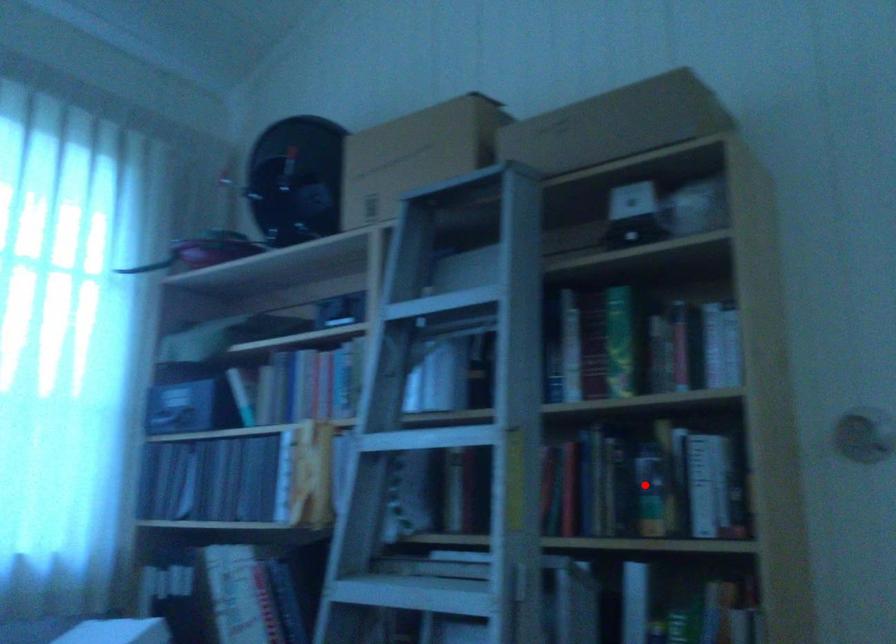
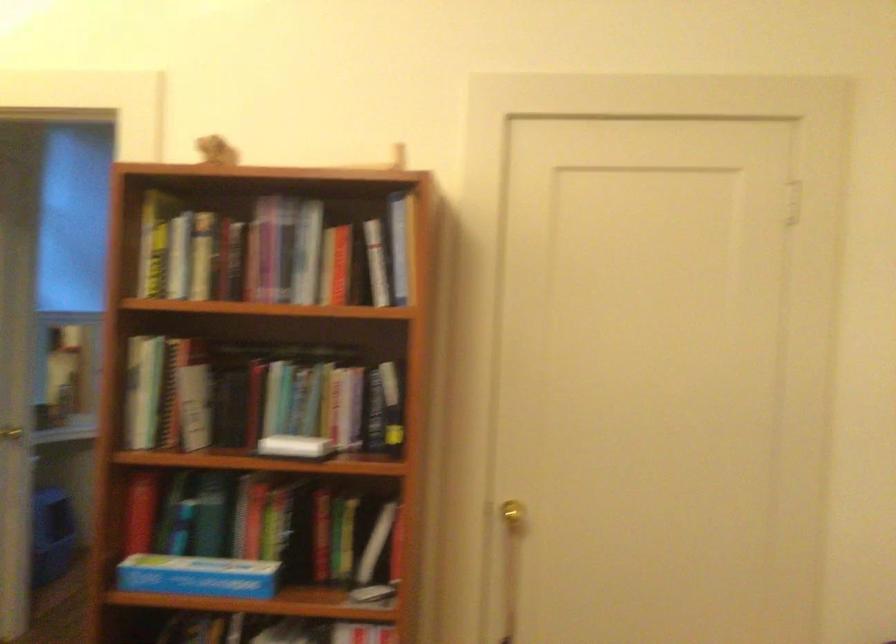
Question: I am providing you with two images of the same scene from different viewpoints. A red point is marked on the first image. Can you still see the location of the red point in image 2?

Choices:
 (A) Yes
 (B) No

Answer: (B)